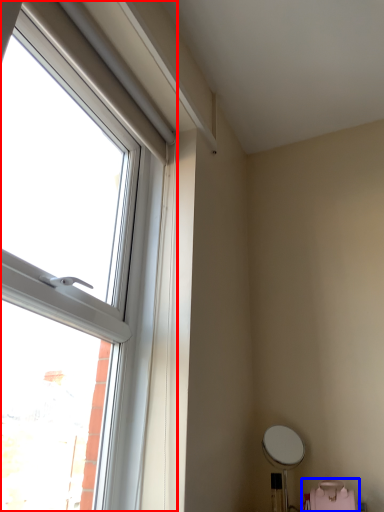
Question: Among these objects, which one is farthest to the camera, window (highlighted by a red box) or swivel chair (highlighted by a blue box)?

Choices:
 (A) window
 (B) swivel chair

Answer: (B)